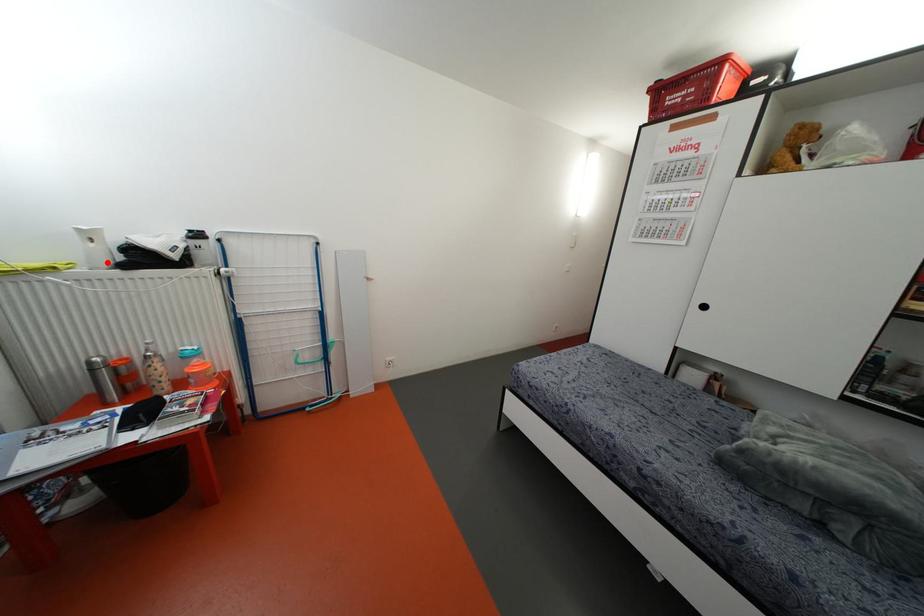
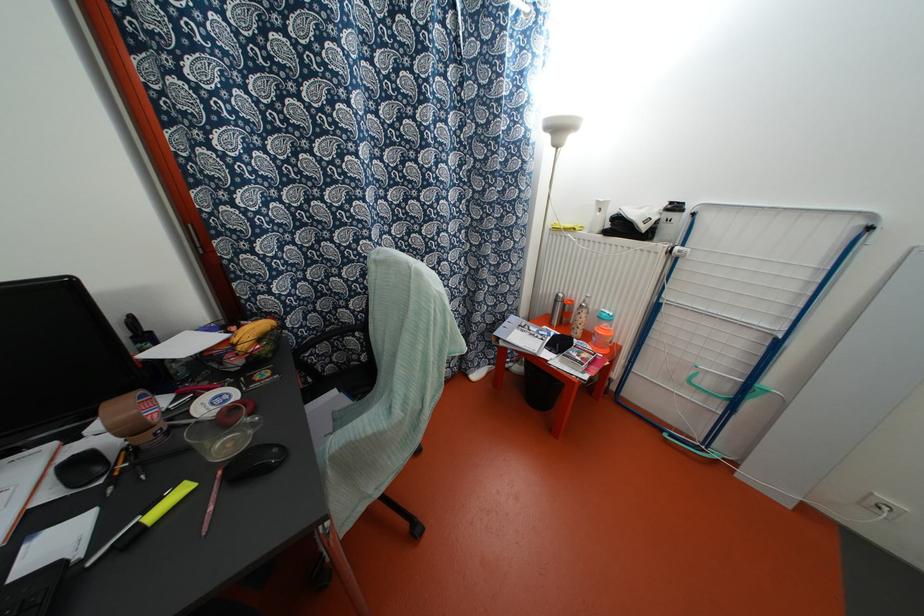
The point at the highlighted location is marked in the first image. Where is the corresponding point in the second image?

(599, 228)